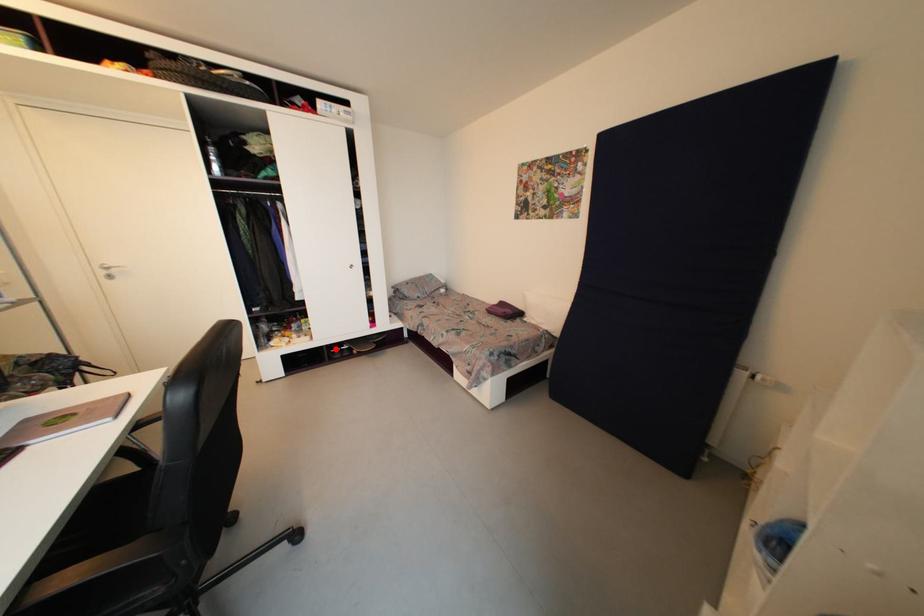
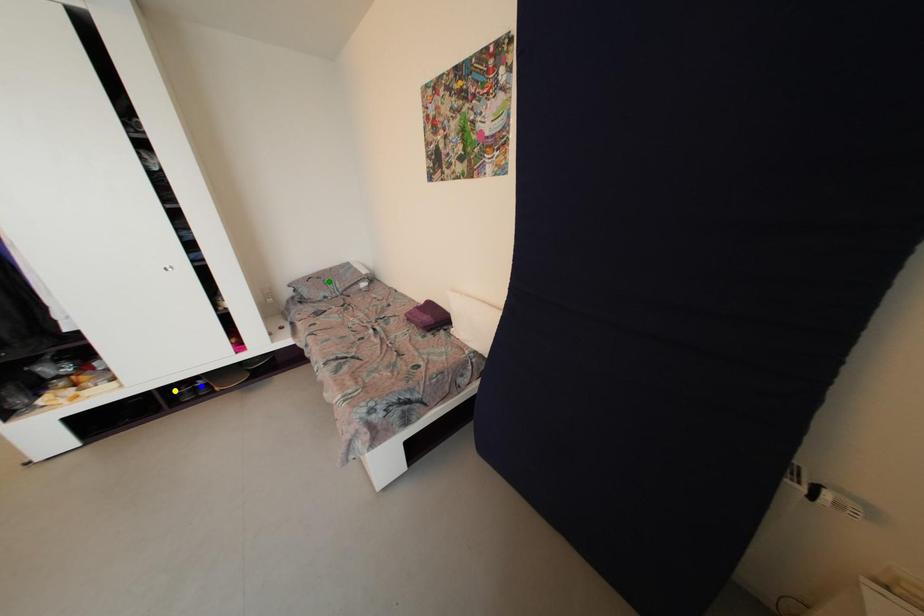
Question: I am providing you with two images of the same scene from different viewpoints. A red point is marked on the first image. You are given multiple points on the second image. Which point in image 2 represents the same 3d spot as the red point in image 1?

Choices:
 (A) green point
 (B) blue point
 (C) yellow point

Answer: (C)